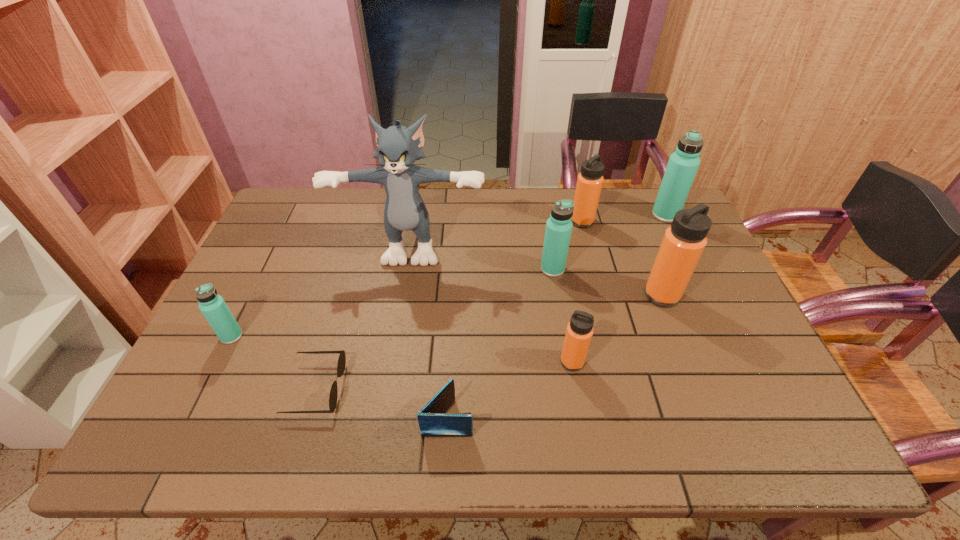
You are a GUI agent. You are given a task and a screenshot of the screen. Output one action in this format:
    pyautogui.click(x=<x>, y=<y>)
    Task: Click on the free space between the rightmost aqua thermos bottle and the tallest object
    
    Given the screenshot: What is the action you would take?
    pyautogui.click(x=540, y=229)

Where is `vacant area between the rightmost orange thermos bottle and the leftmost orange thermos bottle`? vacant area between the rightmost orange thermos bottle and the leftmost orange thermos bottle is located at coordinates (617, 328).

At what (x,y) coordinates should I click in order to perform the action: click on empty location between the sunglasses and the second orange thermos bottle from right to left. Please return your answer as a coordinate pair (x, y). Looking at the image, I should click on (449, 305).

The width and height of the screenshot is (960, 540). In order to click on free space between the cat and the nearest aqua thermos bottle in this screenshot , I will do `click(323, 289)`.

Point out which object is positioned as the seventh nearest to the blue wallet. Please provide its 2D coordinates. Your answer should be formatted as a tuple, i.e. [(x, y)], where the tuple contains the x and y coordinates of a point satisfying the conditions above.

[(589, 183)]

Point out which object is positioned as the third nearest to the black sunglasses. Please provide its 2D coordinates. Your answer should be formatted as a tuple, i.e. [(x, y)], where the tuple contains the x and y coordinates of a point satisfying the conditions above.

[(405, 210)]

Choose which thermos bottle is the second nearest neighbor to the nearest thermos bottle. Please provide its 2D coordinates. Your answer should be formatted as a tuple, i.e. [(x, y)], where the tuple contains the x and y coordinates of a point satisfying the conditions above.

[(558, 230)]

Identify which thermos bottle is located as the third nearest to the blue cat. Please provide its 2D coordinates. Your answer should be formatted as a tuple, i.e. [(x, y)], where the tuple contains the x and y coordinates of a point satisfying the conditions above.

[(589, 183)]

Select which aqua thermos bottle appears as the second closest to the leftmost object. Please provide its 2D coordinates. Your answer should be formatted as a tuple, i.e. [(x, y)], where the tuple contains the x and y coordinates of a point satisfying the conditions above.

[(683, 164)]

The width and height of the screenshot is (960, 540). What are the coordinates of `aqua thermos bottle that stands as the second closest to the third farthest thermos bottle` in the screenshot? It's located at (213, 307).